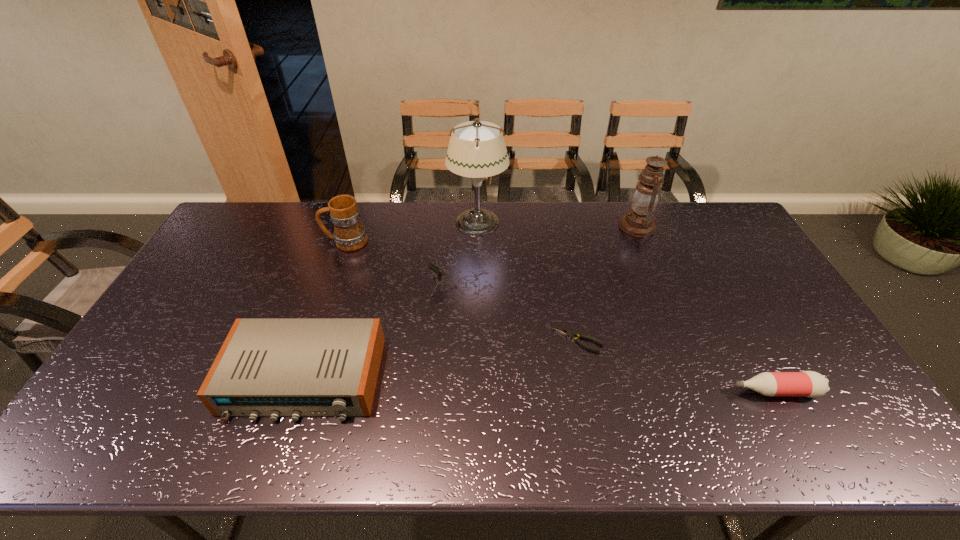
I want to click on oil lamp that is at the far edge, so click(638, 222).

The width and height of the screenshot is (960, 540). I want to click on mug that is at the far edge, so click(x=349, y=234).

Identify the location of object situated at the near edge. The width and height of the screenshot is (960, 540). (266, 367).

The image size is (960, 540). I want to click on object positioned at the right edge, so click(811, 384).

This screenshot has width=960, height=540. I want to click on free spot at the far edge of the desktop, so click(x=361, y=213).

The height and width of the screenshot is (540, 960). I want to click on blank space at the near edge, so click(337, 434).

Where is `free location at the left edge of the desktop`? Image resolution: width=960 pixels, height=540 pixels. free location at the left edge of the desktop is located at coordinates (183, 299).

I want to click on vacant space at the right edge of the desktop, so click(x=739, y=265).

You are a GUI agent. You are given a task and a screenshot of the screen. Output one action in this format:
    pyautogui.click(x=<x>, y=<y>)
    Task: Click on the vacant area that lies between the microphone and the sixth shortest object
    The image size is (960, 540).
    Given the screenshot: What is the action you would take?
    pyautogui.click(x=546, y=257)

You are a GUI agent. You are given a task and a screenshot of the screen. Output one action in this format:
    pyautogui.click(x=<x>, y=<y>)
    Task: Click on the vacant space in between the shortest object and the bottle
    The height and width of the screenshot is (540, 960).
    Given the screenshot: What is the action you would take?
    pyautogui.click(x=676, y=366)